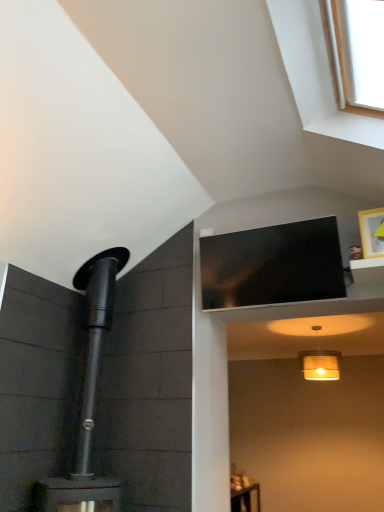
Question: Is the position of white wood window at upper right more distant than that of black glossy tv at upper center?

Choices:
 (A) no
 (B) yes

Answer: (A)

Question: From a real-world perspective, is white wood window at upper right physically above black glossy tv at upper center?

Choices:
 (A) no
 (B) yes

Answer: (B)

Question: Considering the relative sizes of white wood window at upper right and black glossy tv at upper center in the image provided, is white wood window at upper right bigger than black glossy tv at upper center?

Choices:
 (A) no
 (B) yes

Answer: (B)

Question: Does white wood window at upper right turn towards black glossy tv at upper center?

Choices:
 (A) yes
 (B) no

Answer: (B)

Question: Is black glossy tv at upper center completely or partially inside white wood window at upper right?

Choices:
 (A) no
 (B) yes

Answer: (A)

Question: From the image's perspective, relative to black glossy tv at upper center, is matte white lampshade at lower center above or below?

Choices:
 (A) above
 (B) below

Answer: (B)

Question: Would you say matte white lampshade at lower center is inside or outside black glossy tv at upper center?

Choices:
 (A) outside
 (B) inside

Answer: (A)

Question: Does point (307, 356) appear closer or farther from the camera than point (235, 287)?

Choices:
 (A) farther
 (B) closer

Answer: (A)

Question: From a real-world perspective, is matte white lampshade at lower center physically located above or below black glossy tv at upper center?

Choices:
 (A) above
 (B) below

Answer: (B)

Question: Relative to wooden picture frame at upper right, is black glossy tv at upper center in front or behind?

Choices:
 (A) behind
 (B) front

Answer: (A)

Question: From the image's perspective, relative to wooden picture frame at upper right, is black glossy tv at upper center above or below?

Choices:
 (A) below
 (B) above

Answer: (A)

Question: Looking at their shapes, would you say black glossy tv at upper center is wider or thinner than wooden picture frame at upper right?

Choices:
 (A) wide
 (B) thin

Answer: (A)

Question: Is point (314, 280) closer or farther from the camera than point (375, 247)?

Choices:
 (A) farther
 (B) closer

Answer: (B)

Question: From the image's perspective, is matte white lampshade at lower center located above or below wooden picture frame at upper right?

Choices:
 (A) above
 (B) below

Answer: (B)

Question: Looking at their shapes, would you say matte white lampshade at lower center is wider or thinner than wooden picture frame at upper right?

Choices:
 (A) wide
 (B) thin

Answer: (A)